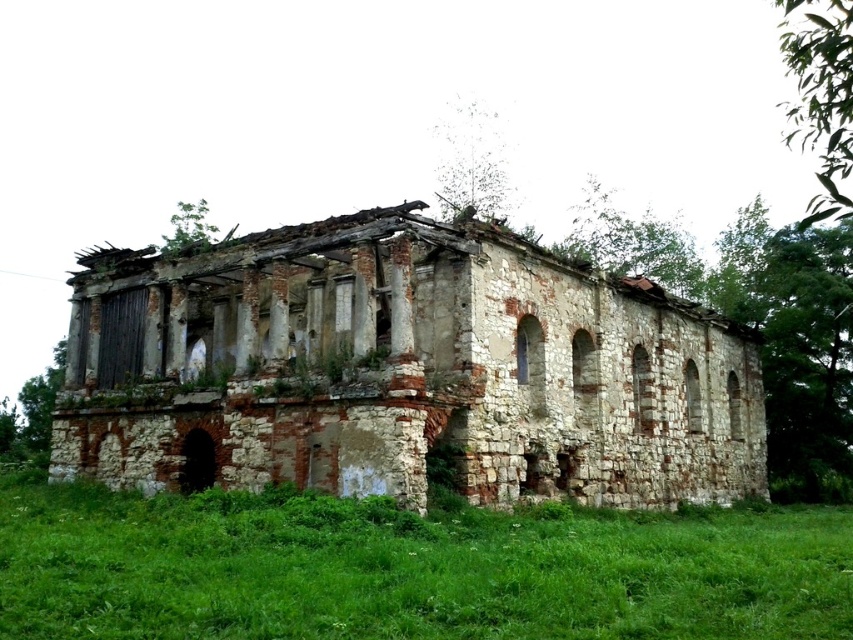
Question: Does weathered stone ruins at center have a greater width compared to green grass at lower center?

Choices:
 (A) yes
 (B) no

Answer: (A)

Question: Which point is farther to the camera?

Choices:
 (A) (320, 520)
 (B) (554, 417)

Answer: (B)

Question: Does weathered stone ruins at center appear under green grass at lower center?

Choices:
 (A) yes
 (B) no

Answer: (B)

Question: Is the position of weathered stone ruins at center more distant than that of green grass at lower center?

Choices:
 (A) yes
 (B) no

Answer: (A)

Question: Which point appears farthest from the camera in this image?

Choices:
 (A) (236, 307)
 (B) (48, 499)

Answer: (A)